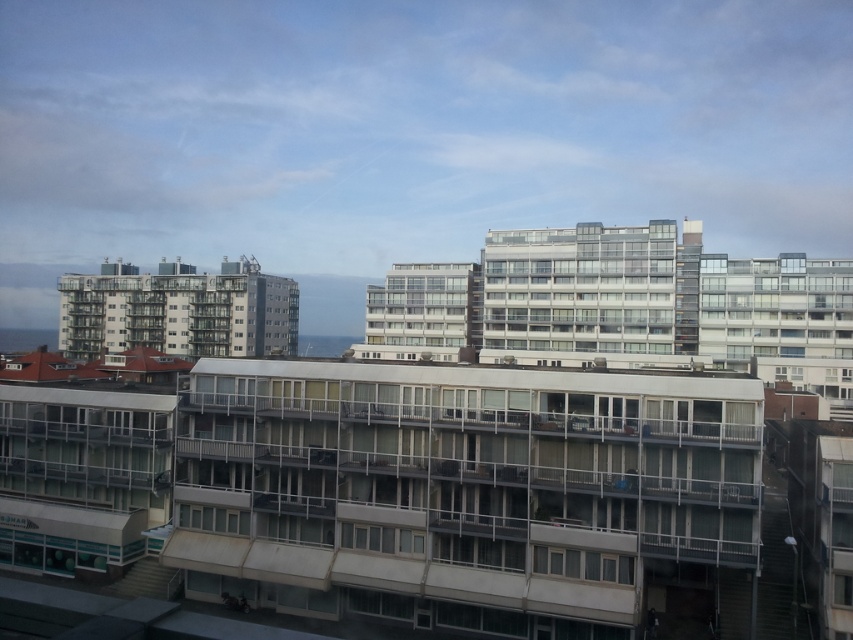
Can you confirm if white concrete building at center is positioned to the right of matte glass building at left?

Correct, you'll find white concrete building at center to the right of matte glass building at left.

Describe the element at coordinates (465, 492) in the screenshot. I see `white concrete building at center` at that location.

The height and width of the screenshot is (640, 853). Find the location of `white concrete building at center`. white concrete building at center is located at coordinates (465, 492).